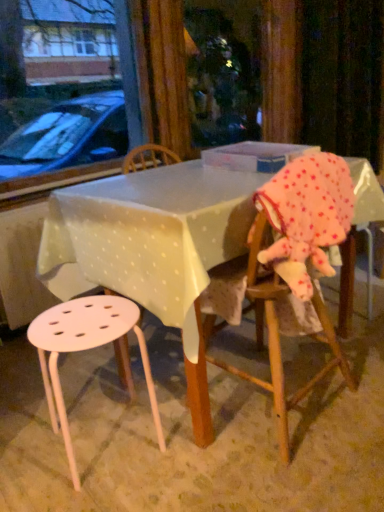
Where is `unoccupied region to the right of wooden chair at right`? The image size is (384, 512). unoccupied region to the right of wooden chair at right is located at coordinates (352, 378).